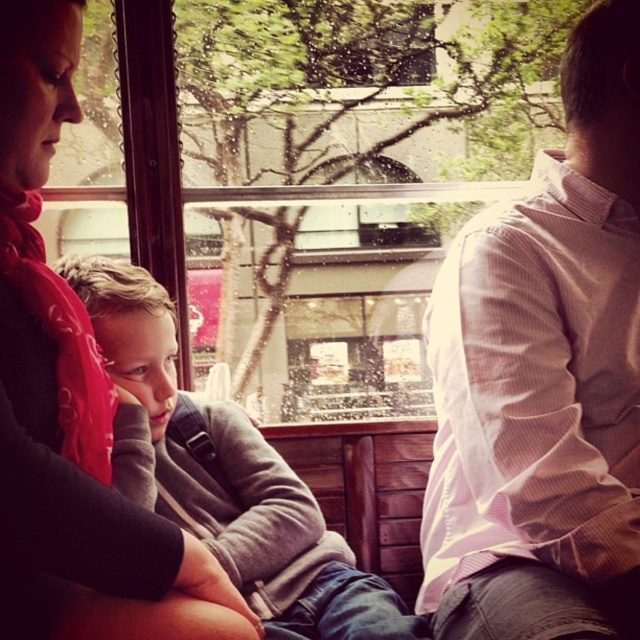
Can you confirm if matte red scarf at upper left is positioned above gray fleece sweater at center?

Yes.

You are a GUI agent. You are given a task and a screenshot of the screen. Output one action in this format:
    pyautogui.click(x=<x>, y=<y>)
    Task: Click on the matte red scarf at upper left
    
    Given the screenshot: What is the action you would take?
    pyautogui.click(x=72, y=404)

Can you confirm if white striped shirt at right is positioned above gray fleece sweater at center?

Yes.

Is white striped shirt at right behind gray fleece sweater at center?

No.

Does point (596, 186) lie in front of point (124, 266)?

Yes, it is in front of point (124, 266).

You are a GUI agent. You are given a task and a screenshot of the screen. Output one action in this format:
    pyautogui.click(x=<x>, y=<y>)
    Task: Click on the white striped shirt at right
    This screenshot has height=640, width=640.
    Given the screenshot: What is the action you would take?
    pyautogui.click(x=545, y=378)

Does white striped shirt at right have a greater height compared to matte red scarf at upper left?

Yes, white striped shirt at right is taller than matte red scarf at upper left.

Image resolution: width=640 pixels, height=640 pixels. What do you see at coordinates (545, 378) in the screenshot? I see `white striped shirt at right` at bounding box center [545, 378].

Does point (593, 385) come closer to viewer compared to point (10, 572)?

No, it is behind (10, 572).

The image size is (640, 640). What are the coordinates of `white striped shirt at right` in the screenshot? It's located at (545, 378).